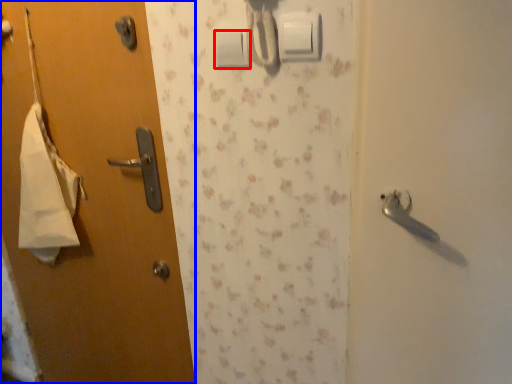
Question: Which object is further to the camera taking this photo, light switch (highlighted by a red box) or door (highlighted by a blue box)?

Choices:
 (A) light switch
 (B) door

Answer: (B)